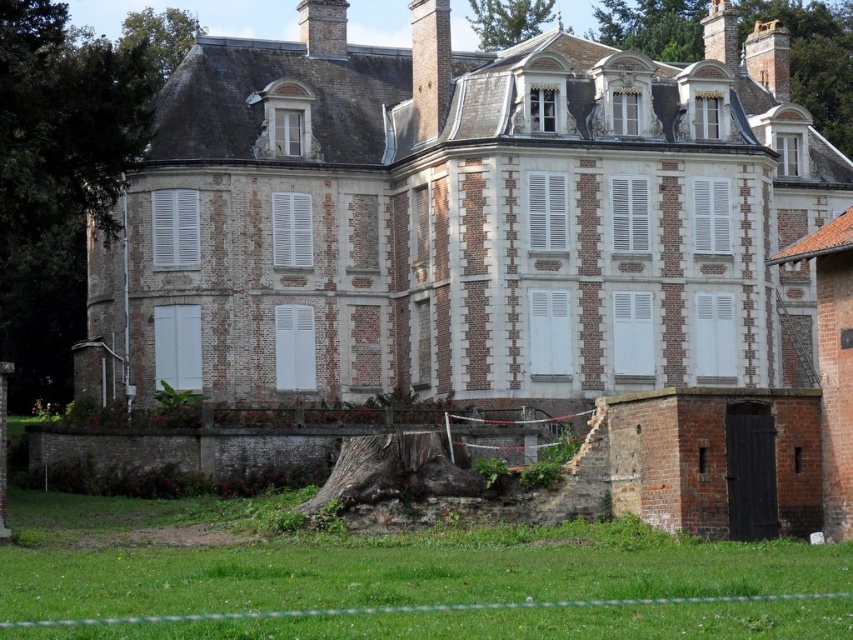
Is smooth gray chimney at upper center thinner than smooth stone chimney at upper right?

No.

Does smooth gray chimney at upper center have a smaller size compared to smooth stone chimney at upper right?

Incorrect, smooth gray chimney at upper center is not smaller in size than smooth stone chimney at upper right.

Measure the distance between point (341, 26) and camera.

Point (341, 26) is 89.59 meters from camera.

In order to click on smooth gray chimney at upper center in this screenshot , I will do `click(323, 28)`.

Between point (440, 83) and point (721, 17), which one is positioned in front?

Positioned in front is point (440, 83).

Who is positioned more to the left, brick chimney at upper center or smooth stone chimney at upper right?

Positioned to the left is brick chimney at upper center.

Does point (447, 10) come in front of point (723, 60)?

Yes, point (447, 10) is closer to viewer.

Locate an element on the screen. brick chimney at upper center is located at coordinates (428, 67).

Which of these two, smooth brick chimney at upper right or smooth gray chimney at upper center, stands shorter?

smooth brick chimney at upper right

Which is behind, point (764, 58) or point (343, 52)?

The point (764, 58) is behind.

The image size is (853, 640). I want to click on smooth brick chimney at upper right, so click(769, 58).

Find the location of a particular element. This screenshot has width=853, height=640. smooth brick chimney at upper right is located at coordinates (769, 58).